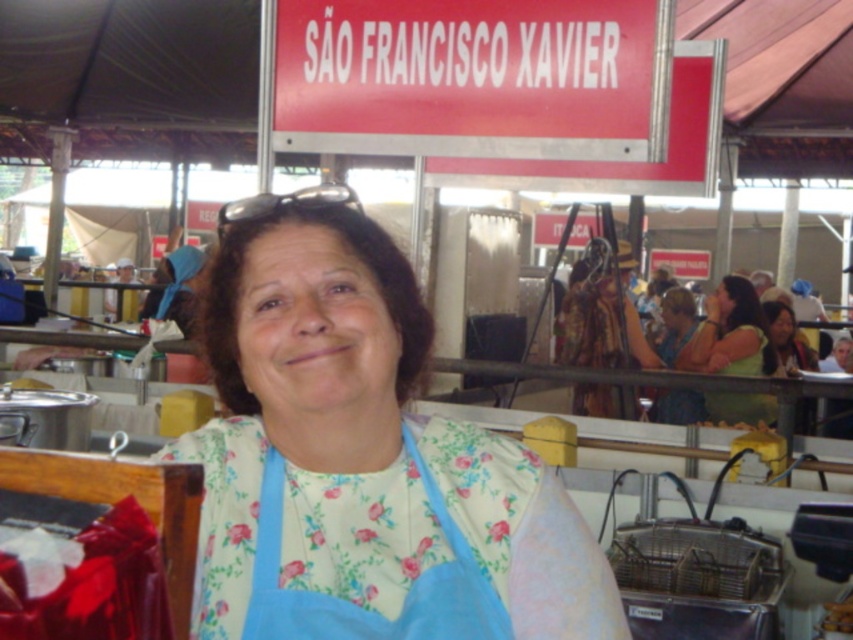
You are a customer at the market and want to approach the vendor wearing the blue floral fabric apron at center and the green fabric shirt at right. Which piece of clothing will you see first as you walk towards them?

The blue floral fabric apron at center will be seen first because it is closer to the viewer than the green fabric shirt at right.

You are a customer at the market and want to find the stall named after a saint. You see the red plastic sign at upper center and the blue floral fabric apron at center. Which object is closer to you?

The red plastic sign at upper center is closer to you because it is further to the viewer than the blue floral fabric apron at center.